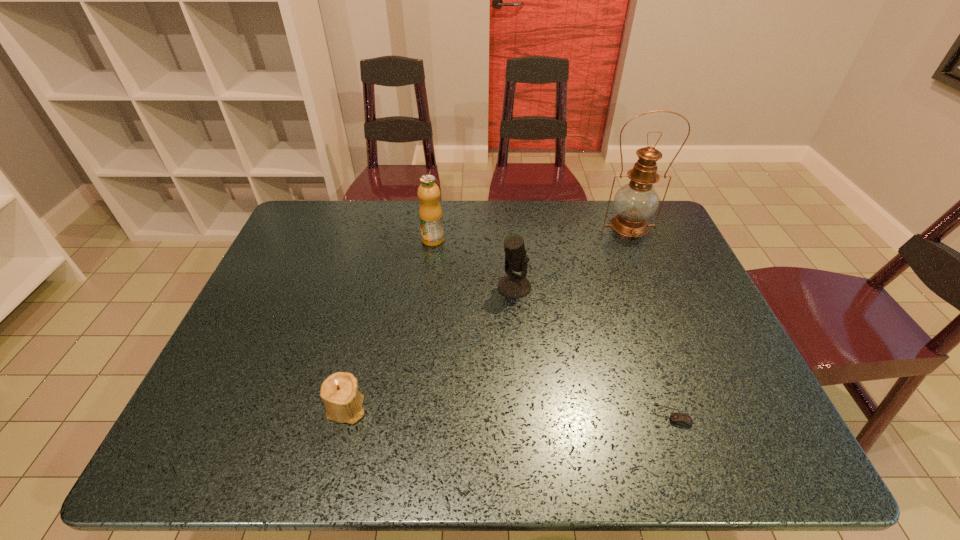
At what (x,y) coordinates should I click in order to perform the action: click on vacant space located 0.370m on the front of the third farthest object. Please return your answer as a coordinate pair (x, y). This screenshot has width=960, height=540. Looking at the image, I should click on tap(525, 424).

Image resolution: width=960 pixels, height=540 pixels. I want to click on free spot located 0.090m on the left of the leftmost object, so pos(285,408).

Identify the location of free space located 0.200m on the left of the mouse. This screenshot has width=960, height=540. 562,415.

Locate an element on the screen. Image resolution: width=960 pixels, height=540 pixels. oil lamp that is at the far edge is located at coordinates (635, 202).

I want to click on fruit juice situated at the far edge, so click(430, 212).

This screenshot has width=960, height=540. Identify the location of candle_holder positioned at the near edge. (343, 402).

Where is `mouse that is at the near edge`? mouse that is at the near edge is located at coordinates (677, 418).

This screenshot has height=540, width=960. Find the location of `object that is positioned at the right edge`. object that is positioned at the right edge is located at coordinates (635, 202).

Where is `object that is at the far right corner`? The image size is (960, 540). object that is at the far right corner is located at coordinates (635, 202).

Where is `vacant position at the far edge of the desktop`? This screenshot has height=540, width=960. vacant position at the far edge of the desktop is located at coordinates (518, 201).